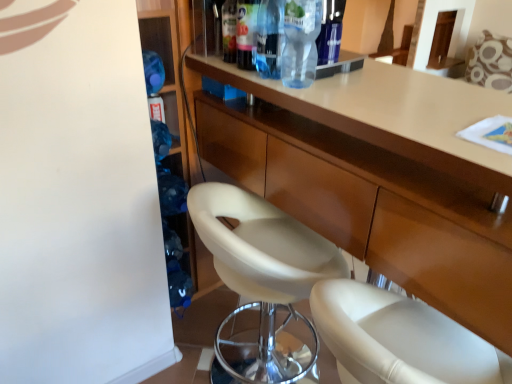
Find the location of a particular element. This screenshot has height=384, width=512. vacant space in front of transparent plastic bottle at upper center, the 4th bottle from the left is located at coordinates (323, 98).